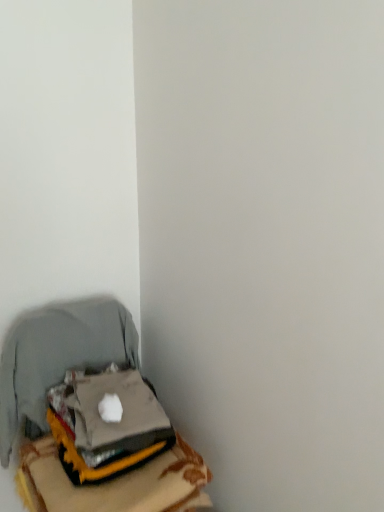
Where is `metallic gray laptop at lower left`? The height and width of the screenshot is (512, 384). metallic gray laptop at lower left is located at coordinates (67, 362).

Measure the distance between point [55,333] and camera.

Point [55,333] and camera are 1.50 meters apart from each other.

What do you see at coordinates (67, 362) in the screenshot?
I see `metallic gray laptop at lower left` at bounding box center [67, 362].

This screenshot has height=512, width=384. Identify the location of metallic gray laptop at lower left. (67, 362).